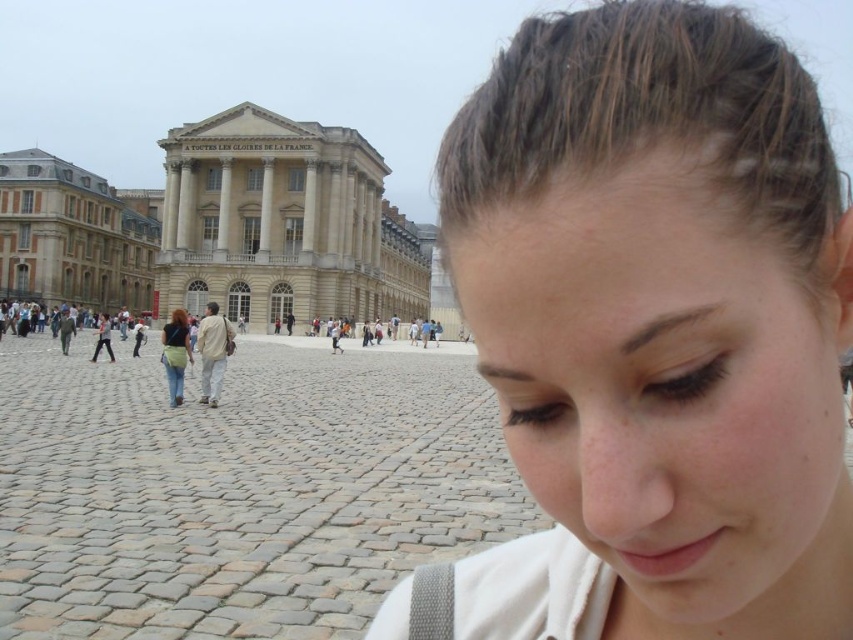
Based on the scene description, where is the smooth brown hair at center located in the image?

The smooth brown hair at center is located at point (x=659, y=323).

Based on the scene description, where is the white stone building at center located in the image?

The white stone building at center is located at point (283, 224).